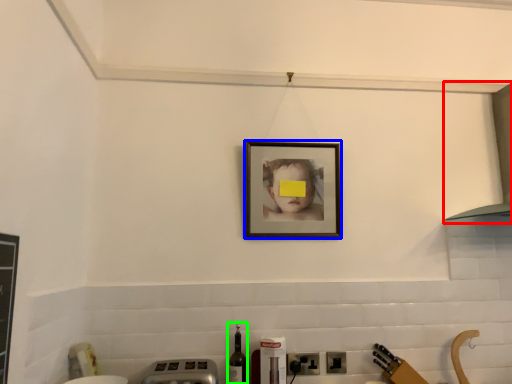
Question: Which object is positioned closest to exhaust hood (highlighted by a red box)? Select from picture frame (highlighted by a blue box) and bottle (highlighted by a green box).

Choices:
 (A) picture frame
 (B) bottle

Answer: (A)